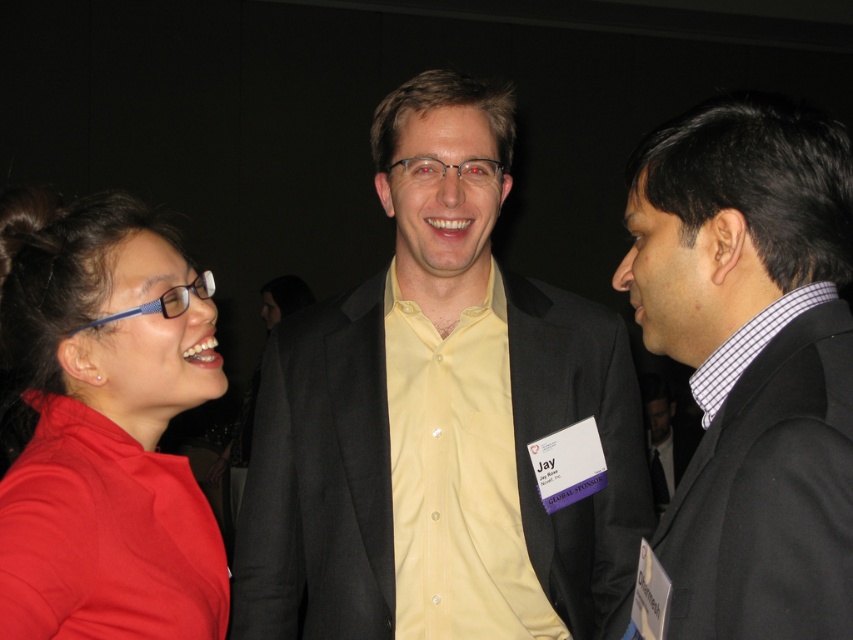
You are organizing a photo shoot and need to arrange the matte black suit at right and the yellow smooth shirt at center in a row. Based on their widths, which should be placed on the left to ensure the arrangement from left to right is from wider to narrower?

The yellow smooth shirt at center should be placed on the left because it is wider than the matte black suit at right, ensuring the arrangement from left to right goes from wider to narrower.

What color is the suit of the person at the coordinate point (752,358)?

The person at coordinate point (752,358) is wearing a matte black suit.